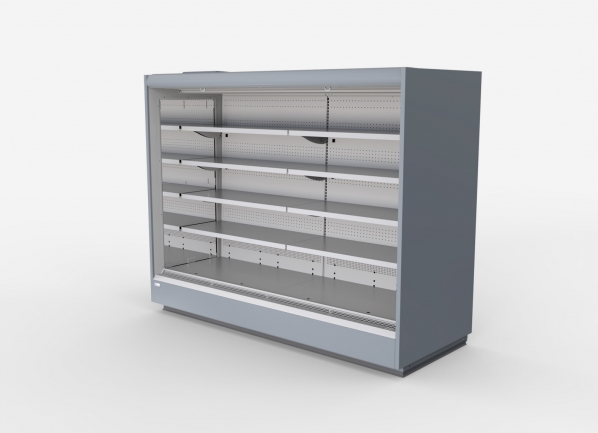
This screenshot has height=433, width=598. Find the location of `bottom shelf`. bottom shelf is located at coordinates (282, 283).